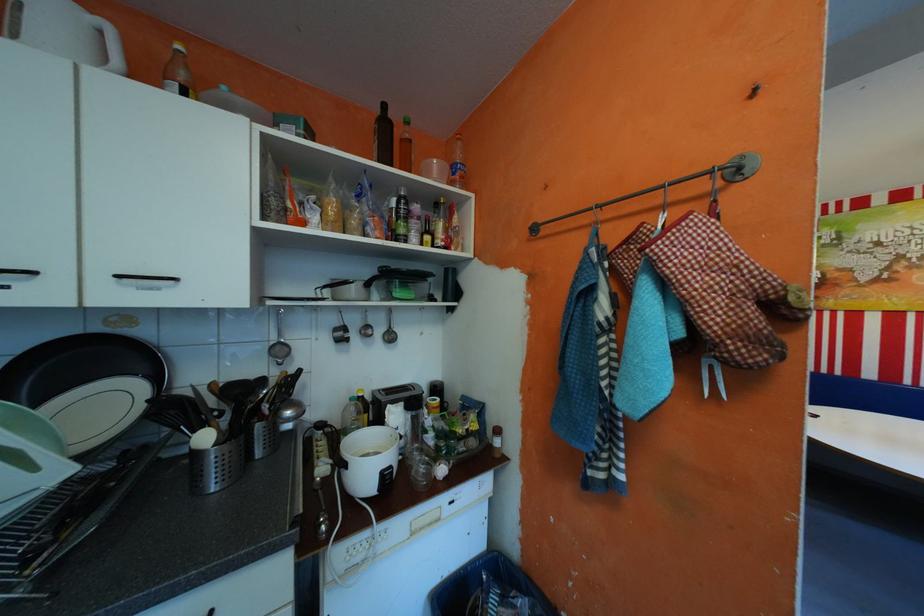
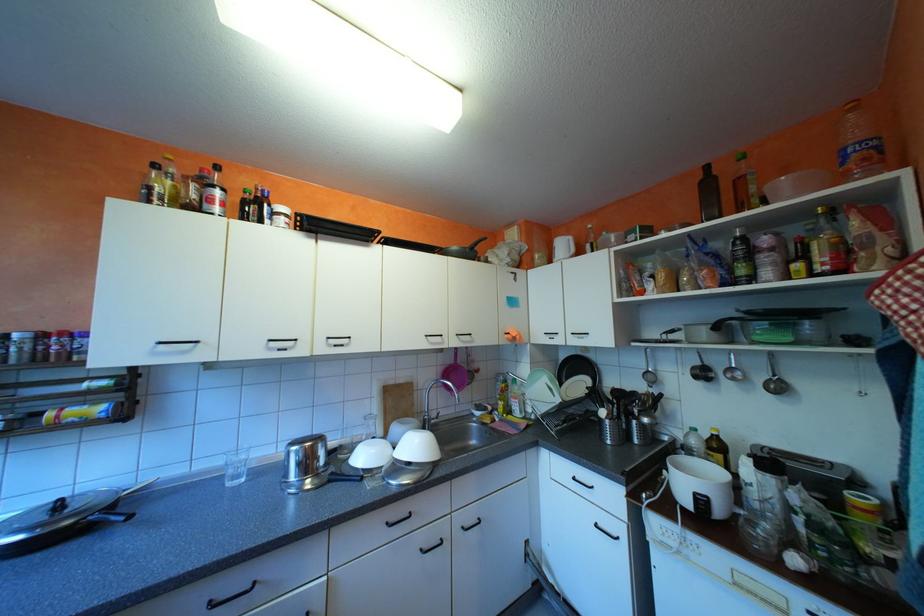
Find the pixel in the second image that matches pixel 347 329 in the first image.

(706, 367)